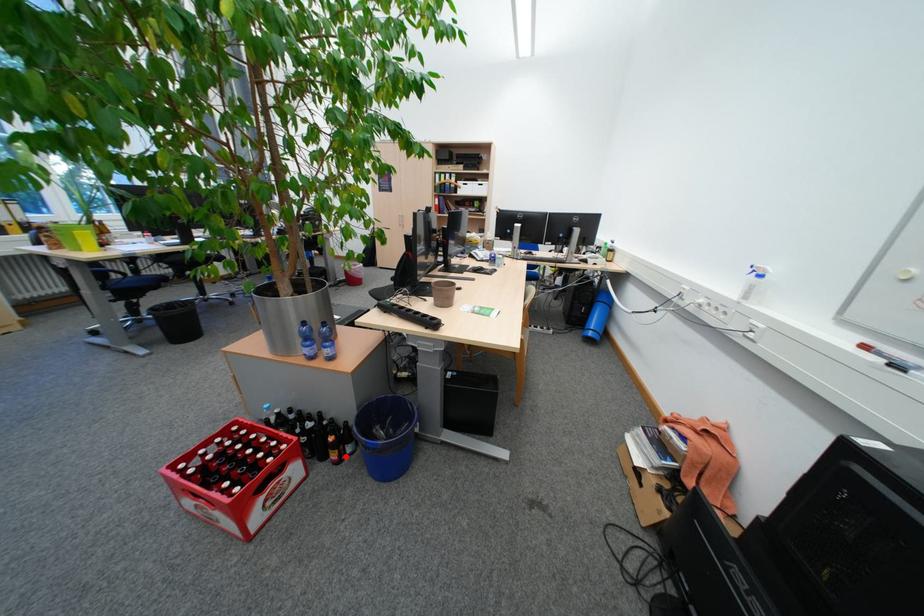
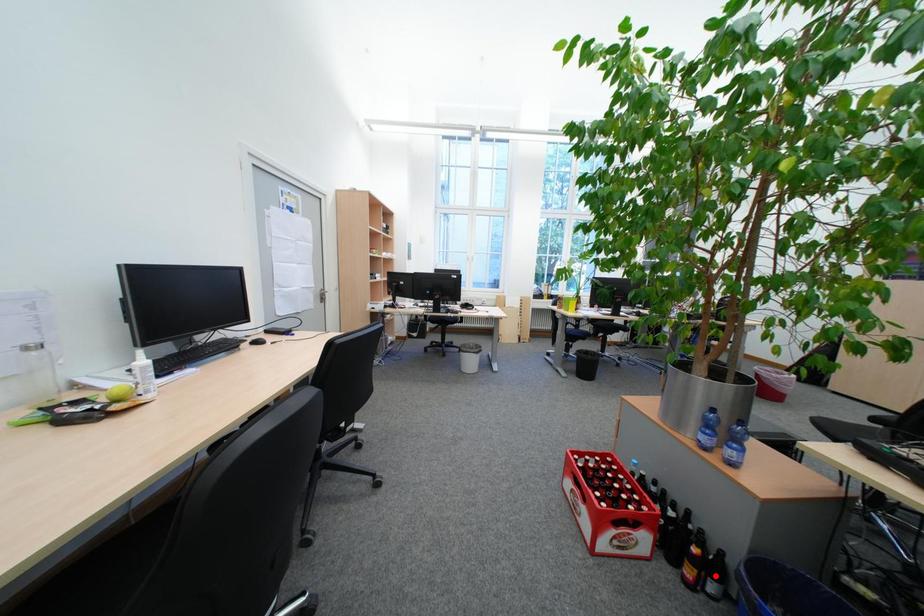
I am providing you with two images of the same scene from different viewpoints. A red point is marked on the first image and another point is marked on the second image. Do the highlighted points in image1 and image2 indicate the same real-world spot?

No